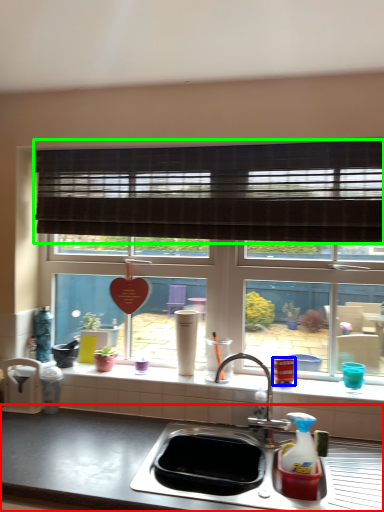
Question: Based on their relative distances, which object is nearer to countertop (highlighted by a red box)? Choose from appliance (highlighted by a blue box) and window blind (highlighted by a green box).

Choices:
 (A) appliance
 (B) window blind

Answer: (A)